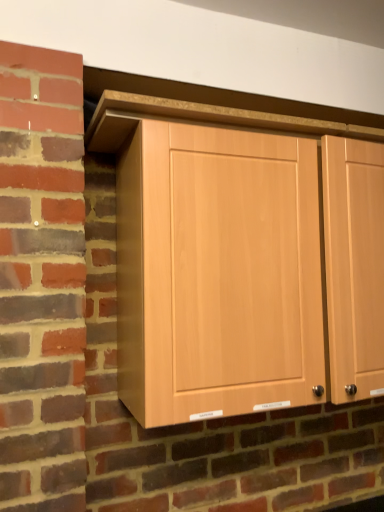
Describe the element at coordinates (242, 258) in the screenshot. The width and height of the screenshot is (384, 512). I see `light wood cabinet at center` at that location.

The height and width of the screenshot is (512, 384). In order to click on light wood cabinet at center in this screenshot , I will do `click(242, 258)`.

The height and width of the screenshot is (512, 384). Find the location of `light wood cabinet at center`. light wood cabinet at center is located at coordinates (242, 258).